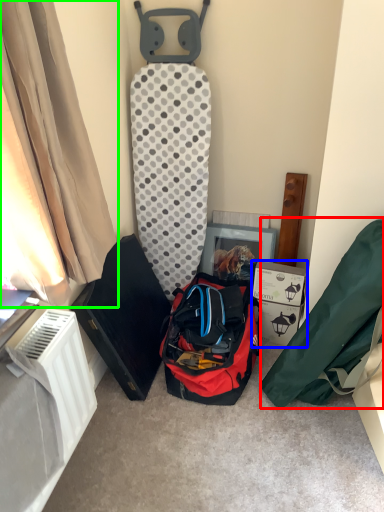
Question: Which is farther away from kit (highlighted by a red box)? cardboard box (highlighted by a blue box) or curtain (highlighted by a green box)?

Choices:
 (A) cardboard box
 (B) curtain

Answer: (B)